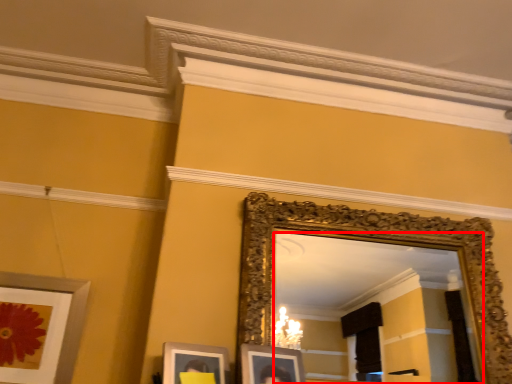
Question: Observing the image, what is the correct spatial positioning of mirror (annotated by the red box) in reference to picture frame?

Choices:
 (A) right
 (B) left

Answer: (A)